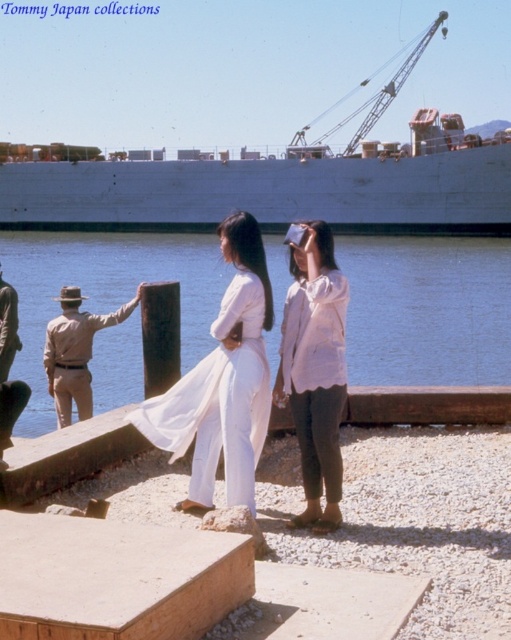
Can you confirm if white silk dress at center is shorter than light beige cotton shirt at center?

No, white silk dress at center is not shorter than light beige cotton shirt at center.

Can you confirm if white silk dress at center is positioned above light beige cotton shirt at center?

Actually, white silk dress at center is below light beige cotton shirt at center.

Is point (239, 486) in front of point (309, 404)?

Yes, point (239, 486) is closer to viewer.

The image size is (511, 640). Identify the location of white silk dress at center. (222, 381).

Measure the distance from white matte ship at upper center to tan/khaki uniform at left.

They are 279.97 feet apart.

The image size is (511, 640). In order to click on white matte ship at upper center in this screenshot , I will do `click(278, 188)`.

Find the location of a particular element. white matte ship at upper center is located at coordinates (278, 188).

Where is `white matte ship at upper center`? white matte ship at upper center is located at coordinates (278, 188).

Can you confirm if light beige cotton shirt at center is positioned to the right of khaki cotton pants at left?

Indeed, light beige cotton shirt at center is positioned on the right side of khaki cotton pants at left.

Is point (304, 424) more distant than point (11, 387)?

No, (304, 424) is in front of (11, 387).

The width and height of the screenshot is (511, 640). I want to click on light beige cotton shirt at center, so click(x=314, y=369).